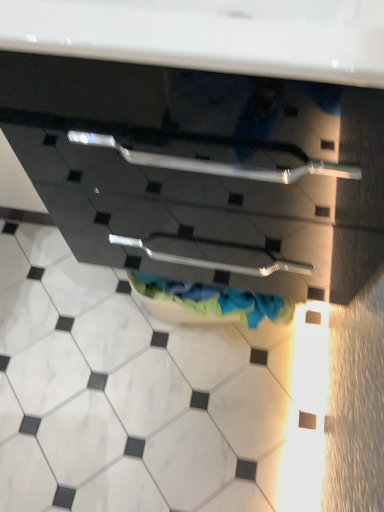
Identify the location of marble tile at center. (147, 397).

Measure the distance between point (113, 390) and camera.

The depth of point (113, 390) is 1.16 meters.

What do you see at coordinates (147, 397) in the screenshot? Image resolution: width=384 pixels, height=512 pixels. I see `marble tile at center` at bounding box center [147, 397].

The width and height of the screenshot is (384, 512). What are the coordinates of `marble tile at center` in the screenshot? It's located at (147, 397).